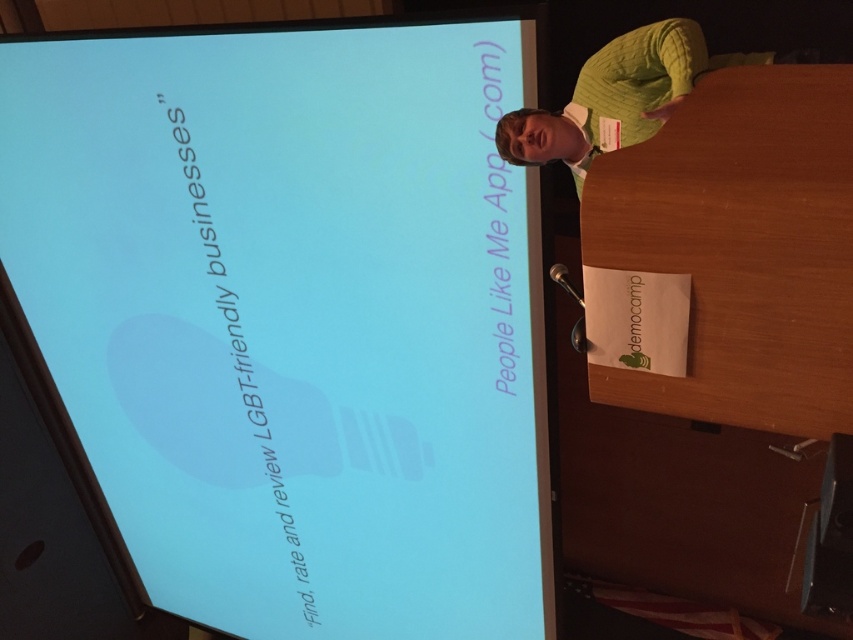
Question: Can you confirm if matte blue screen at upper left is positioned below green knitted sweater at upper right?

Choices:
 (A) no
 (B) yes

Answer: (B)

Question: Which point is farther to the camera?

Choices:
 (A) matte blue screen at upper left
 (B) green knitted sweater at upper right

Answer: (B)

Question: Can you confirm if matte blue screen at upper left is positioned below green knitted sweater at upper right?

Choices:
 (A) yes
 (B) no

Answer: (A)

Question: Is matte blue screen at upper left bigger than green knitted sweater at upper right?

Choices:
 (A) yes
 (B) no

Answer: (A)

Question: Which point is farther to the camera?

Choices:
 (A) matte blue screen at upper left
 (B) green knitted sweater at upper right

Answer: (B)